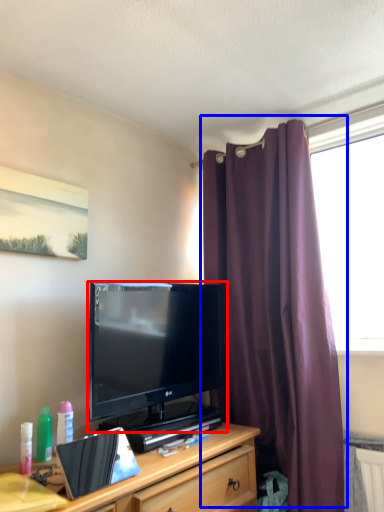
Question: Among these objects, which one is nearest to the camera, television (highlighted by a red box) or curtain (highlighted by a blue box)?

Choices:
 (A) television
 (B) curtain

Answer: (A)